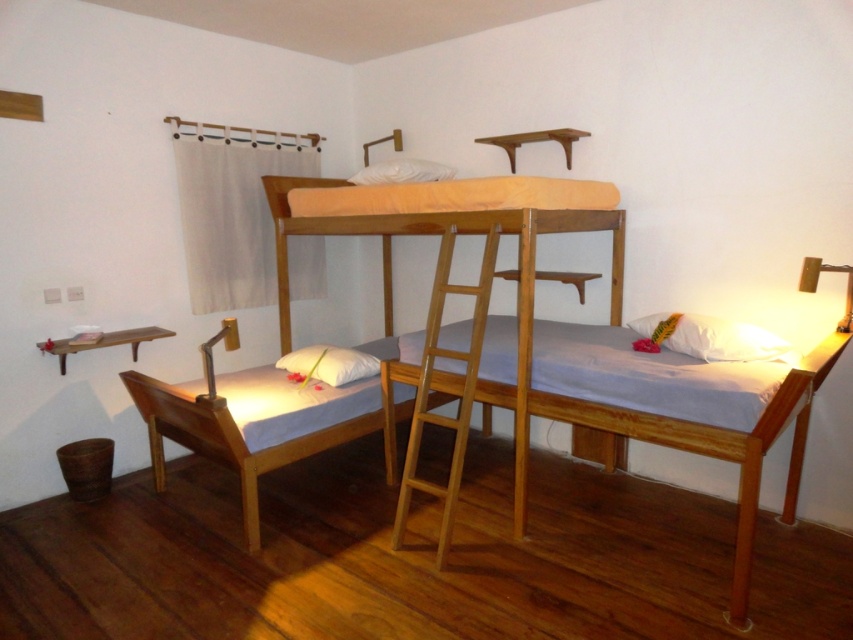
Who is shorter, white soft pillow at upper center or matte white lamp at right?

white soft pillow at upper center is shorter.

Can you confirm if white soft pillow at upper center is bigger than matte white lamp at right?

Yes.

Is point (364, 166) farther from viewer compared to point (810, 257)?

Yes, it is behind point (810, 257).

Locate an element on the screen. The width and height of the screenshot is (853, 640). white soft pillow at upper center is located at coordinates (401, 172).

Is white soft pillow at lower left bigger than white soft pillow at upper center?

Actually, white soft pillow at lower left might be smaller than white soft pillow at upper center.

Image resolution: width=853 pixels, height=640 pixels. What are the coordinates of `white soft pillow at lower left` in the screenshot? It's located at (329, 364).

Image resolution: width=853 pixels, height=640 pixels. Find the location of `white soft pillow at lower left`. white soft pillow at lower left is located at coordinates (329, 364).

Who is shorter, light wood ladder at center or white soft pillow at upper center?

white soft pillow at upper center is shorter.

Between point (410, 454) and point (428, 168), which one is positioned in front?

Positioned in front is point (410, 454).

The height and width of the screenshot is (640, 853). I want to click on light wood ladder at center, so click(457, 396).